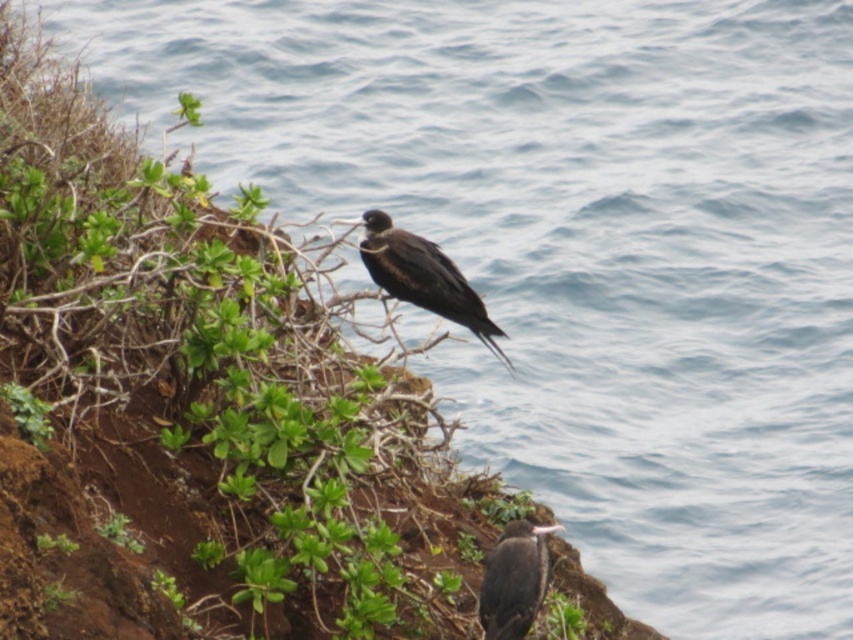
You are a birdwatcher with a camera that has a maximum zoom range of 25 inches. You want to take a closeup photo of the shiny black bird at center and dark brown feathers at center. Can your camera zoom in enough to capture both subjects without moving closer?

The distance between the shiny black bird at center and dark brown feathers at center is 28.15 inches. Since your camera can only zoom up to 25 inches, it cannot capture both subjects in a single closeup photo without moving closer.

You are standing on the cliff edge and see the shiny black bird at center. If you want to toss a small pebble to reach the bird, considering the distance between you and the bird is 5.46 meters, would a typical pebble throw of 5 meters suffice?

The distance between you and the shiny black bird at center is 5.46 meters, which is slightly farther than a typical 5 meter pebble throw. Therefore, the pebble would not reach the bird.

You are a birdwatcher observing the two birds in the coastal scene. You notice the shiny black bird at center and the dark brown feathers at center. Which bird is taller?

The shiny black bird at center is taller than the dark brown feathers at center.